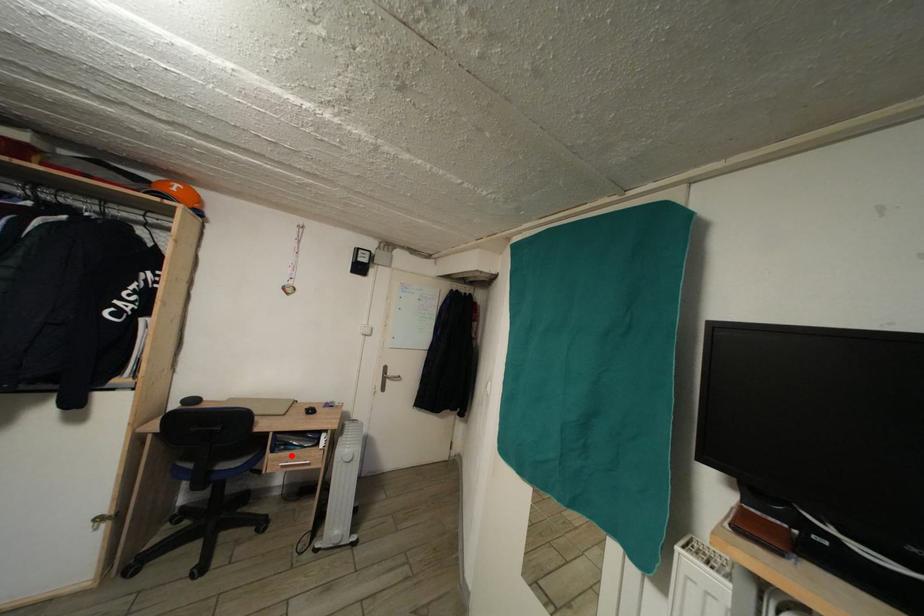
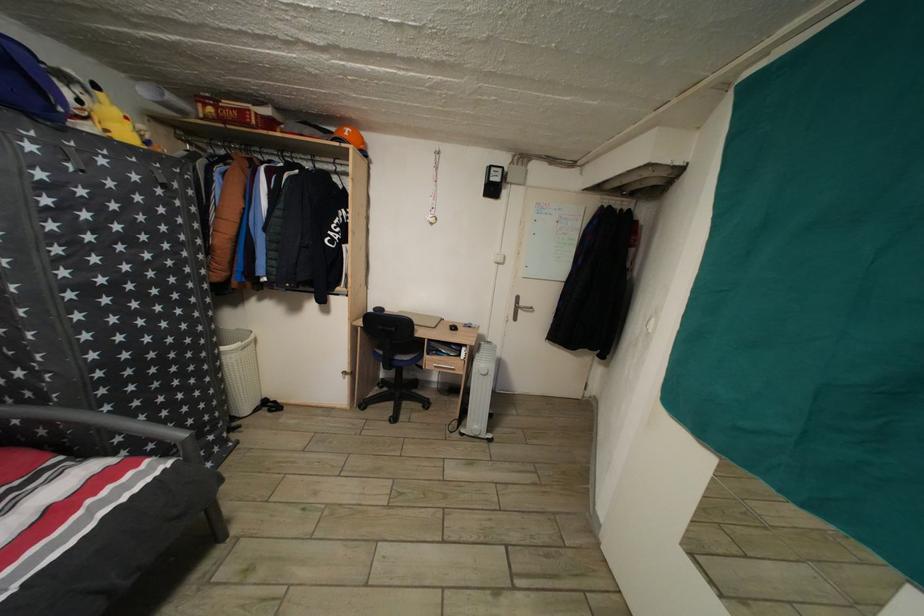
Where in the second image is the point corresponding to the highlighted location from the first image?

(443, 361)